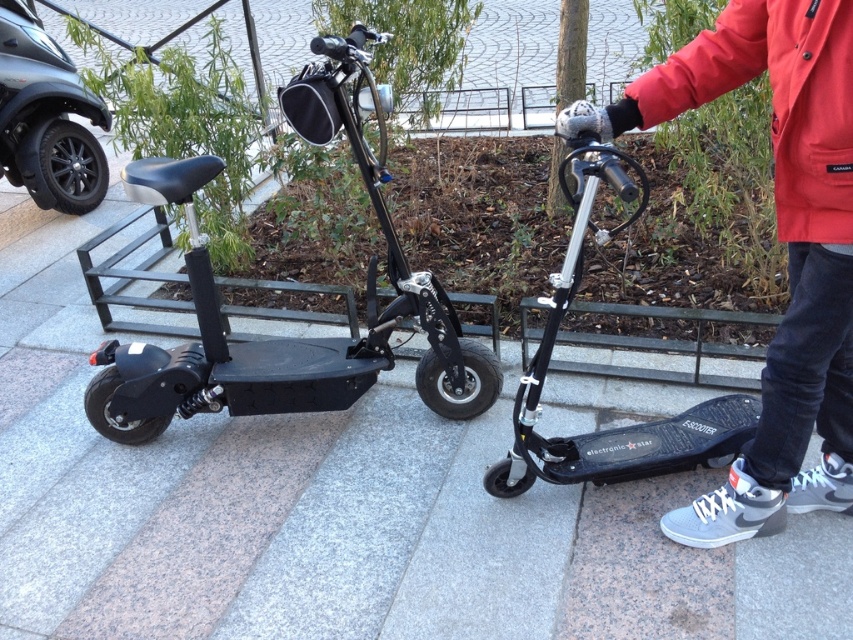
Question: Can you confirm if gray fabric jacket at upper right is positioned below red waterproof jacket at upper right?

Choices:
 (A) no
 (B) yes

Answer: (B)

Question: Is gray fabric jacket at upper right below red waterproof jacket at upper right?

Choices:
 (A) no
 (B) yes

Answer: (B)

Question: Which point is farther from the camera taking this photo?

Choices:
 (A) (798, 72)
 (B) (155, 193)

Answer: (B)

Question: Does black matte scooter at left have a larger size compared to red waterproof jacket at upper right?

Choices:
 (A) no
 (B) yes

Answer: (B)

Question: Among these objects, which one is nearest to the camera?

Choices:
 (A) black matte scooter at left
 (B) gray fabric jacket at upper right

Answer: (B)

Question: Which of the following is the closest to the observer?

Choices:
 (A) red waterproof jacket at upper right
 (B) gray fabric jacket at upper right

Answer: (A)